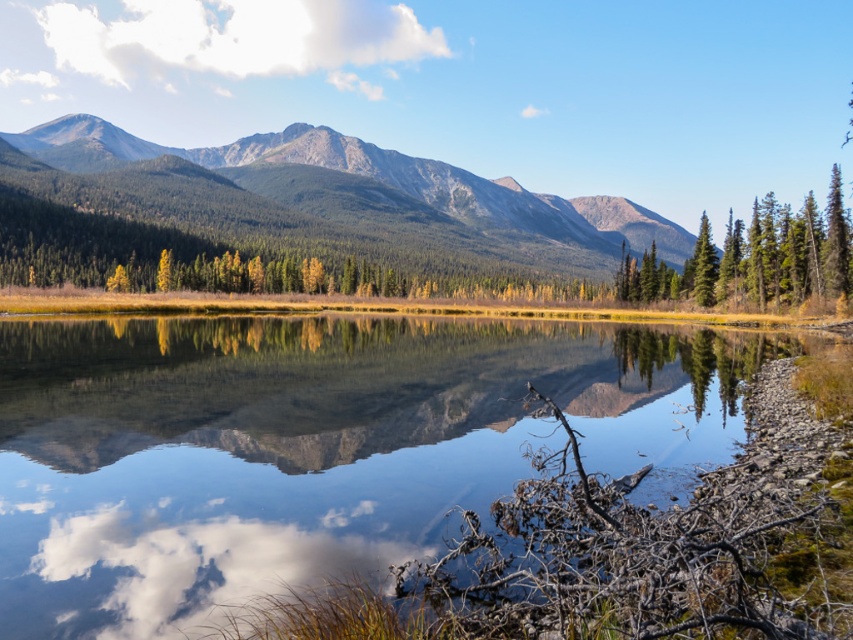
Question: Which object is the closest to the white fluffy cloud at upper left?

Choices:
 (A) white fluffy cloud at lower left
 (B) green matte tree at upper right
 (C) green forested mountain range at upper left
 (D) clear water at center

Answer: (C)

Question: Can you confirm if clear water at center is bigger than green forested mountain range at upper left?

Choices:
 (A) yes
 (B) no

Answer: (B)

Question: Which point is closer to the camera taking this photo?

Choices:
 (A) (384, 58)
 (B) (209, 444)
 (C) (833, 176)

Answer: (B)

Question: Does white fluffy cloud at upper left appear under green matte tree at upper right?

Choices:
 (A) no
 (B) yes

Answer: (A)

Question: Which of the following is the closest to the observer?

Choices:
 (A) (132, 563)
 (B) (339, 392)

Answer: (A)

Question: Does white fluffy cloud at upper left have a greater width compared to green forested mountain range at upper left?

Choices:
 (A) no
 (B) yes

Answer: (A)